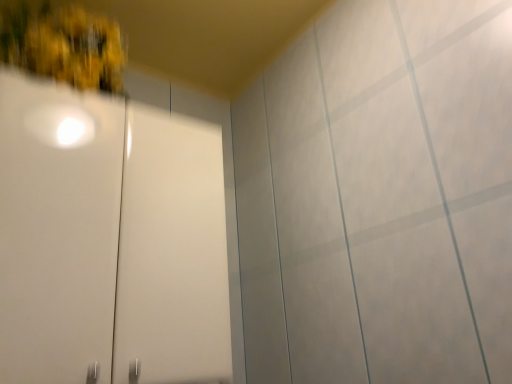
This screenshot has height=384, width=512. I want to click on white glossy cabinet at upper left, so click(109, 242).

Consider the image. Measure the distance between white glossy cabinet at upper left and camera.

white glossy cabinet at upper left is 25.18 inches from camera.

Describe the element at coordinates (109, 242) in the screenshot. The height and width of the screenshot is (384, 512). I see `white glossy cabinet at upper left` at that location.

Locate an element on the screen. The width and height of the screenshot is (512, 384). white glossy cabinet at upper left is located at coordinates (109, 242).